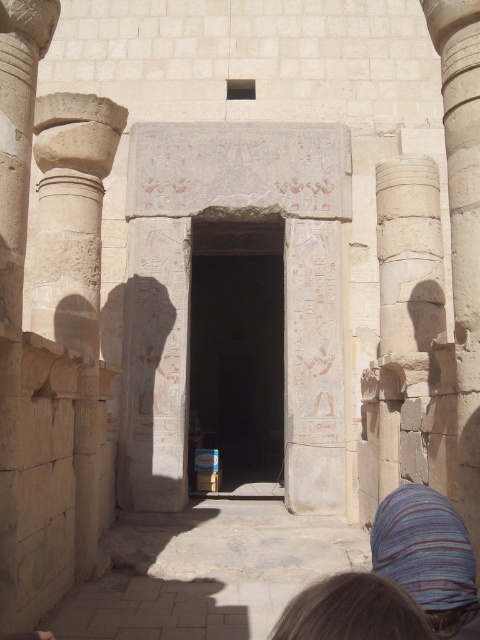
You are an archaeologist examining the ancient Egyptian structure. You notice the dark stone doorway at center and the striped fabric at lower right. Which object is significantly taller?

The dark stone doorway at center is much taller than the striped fabric at lower right.

You are an archaeologist standing at the entrance of the ancient Egyptian temple. You notice the dark stone doorway at center. Based on its coordinates, can you determine if it is positioned closer to the left or right side of the temple structure?

The dark stone doorway at center is positioned at coordinates point (237, 349), which indicates it is slightly to the right of the center point in the temple structure.

You are an archaeologist standing at the entrance of an ancient Egyptian temple. You notice the smooth stone column at right and the brown hair at lower center. Based on the distance between them, can you estimate whether they are close enough to be within arm s reach of each other?

The smooth stone column at right and the brown hair at lower center are 16.17 meters apart from each other, which is much farther than arm s reach. They are not close enough to be within arm s reach of each other.